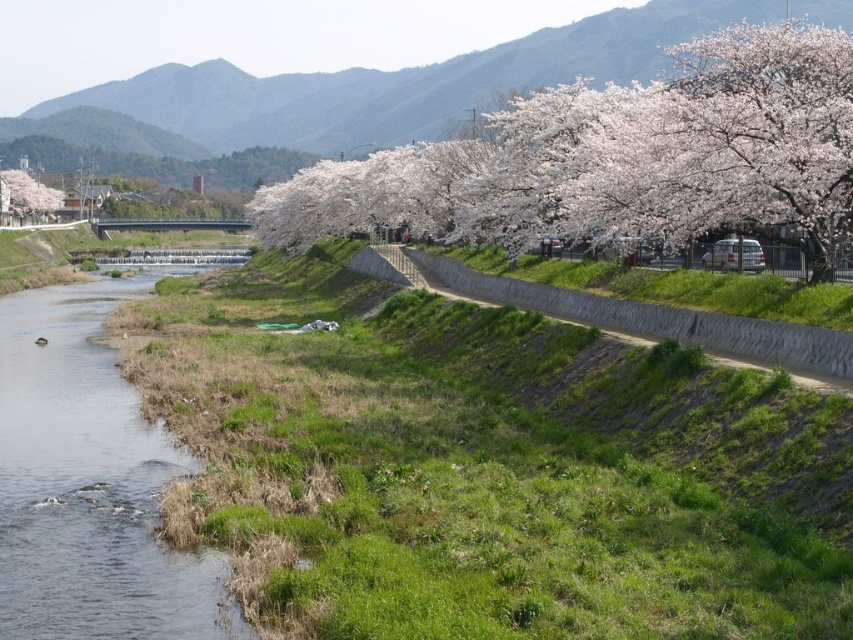
You are a hiker who wants to cross the river to reach the white blossoming tree at upper right. The clear water at river left is flowing gently. Do you think you can safely cross the river at this point?

The white blossoming tree at upper right is 40.05 meters away from the clear water at river left. Since the clear water at river left is flowing gently, it might be possible to cross the river safely at this point, but the distance between them is quite far, so you should assess the river conditions carefully before attempting the crossing.

You are standing at the point closest to the mountains and want to walk towards the river. Which point should you start walking from, point (106,593) or point (33,202)?

You should start walking from point (33,202) because point (106,593) is in front of point (33,202), meaning point (33,202) is closer to the mountains and further from the river.

You are standing at the point marked by the coordinate point at (619, 157) in the image. Looking towards the river, which direction should you walk to reach the paved pathway lined with cherry blossom trees?

The white blossoming tree at upper right is represented by point at (619, 157). Since the pathway is on the right side of the river, you should walk towards the right to reach the paved pathway lined with cherry blossom trees.